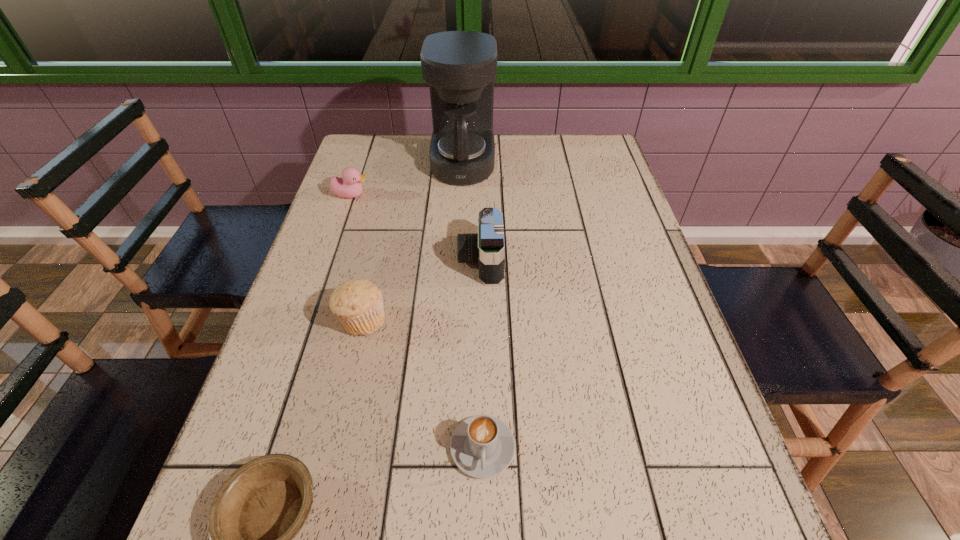
Locate an element on the screen. Image resolution: width=960 pixels, height=540 pixels. the farthest object is located at coordinates (460, 67).

Locate an element on the screen. The width and height of the screenshot is (960, 540). coffee maker is located at coordinates (460, 67).

This screenshot has width=960, height=540. I want to click on camera, so click(x=487, y=247).

The height and width of the screenshot is (540, 960). Find the location of `muffin`. muffin is located at coordinates (358, 303).

Where is `duckling`? duckling is located at coordinates (349, 186).

Identify the location of the fifth tallest object. The height and width of the screenshot is (540, 960). (482, 446).

Where is `vacant point located on the button side of the coffee maker`? This screenshot has width=960, height=540. vacant point located on the button side of the coffee maker is located at coordinates (551, 163).

Find the location of a particular element. The width and height of the screenshot is (960, 540). blank area located on the front-facing side of the third farthest object is located at coordinates (327, 260).

Where is `vacant space located 0.360m on the front-facing side of the third farthest object`? This screenshot has width=960, height=540. vacant space located 0.360m on the front-facing side of the third farthest object is located at coordinates (316, 260).

Where is `vacant space located 0.160m on the front-facing side of the third farthest object`? The image size is (960, 540). vacant space located 0.160m on the front-facing side of the third farthest object is located at coordinates (395, 260).